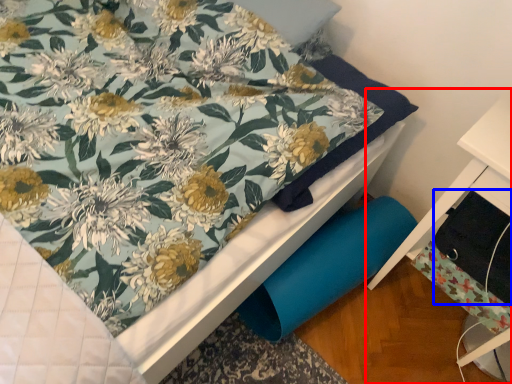
Question: Which point is further to the camera, furniture (highlighted by a red box) or drawer (highlighted by a blue box)?

Choices:
 (A) furniture
 (B) drawer

Answer: (B)